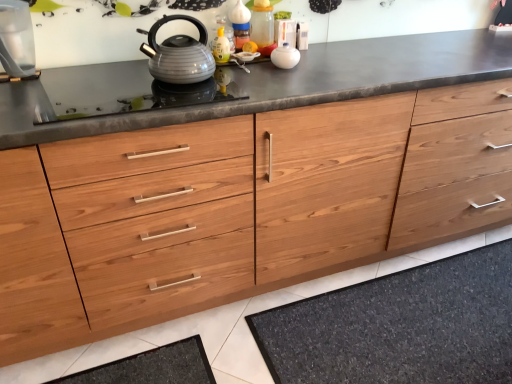
You are a GUI agent. You are given a task and a screenshot of the screen. Output one action in this format:
    pyautogui.click(x=<x>, y=<y>)
    Task: Click on the vacant space that's between matte gray kettle at center and white glossy bowl at upper center, the second appliance in the left-to-right sequence
    
    Given the screenshot: What is the action you would take?
    pyautogui.click(x=242, y=67)